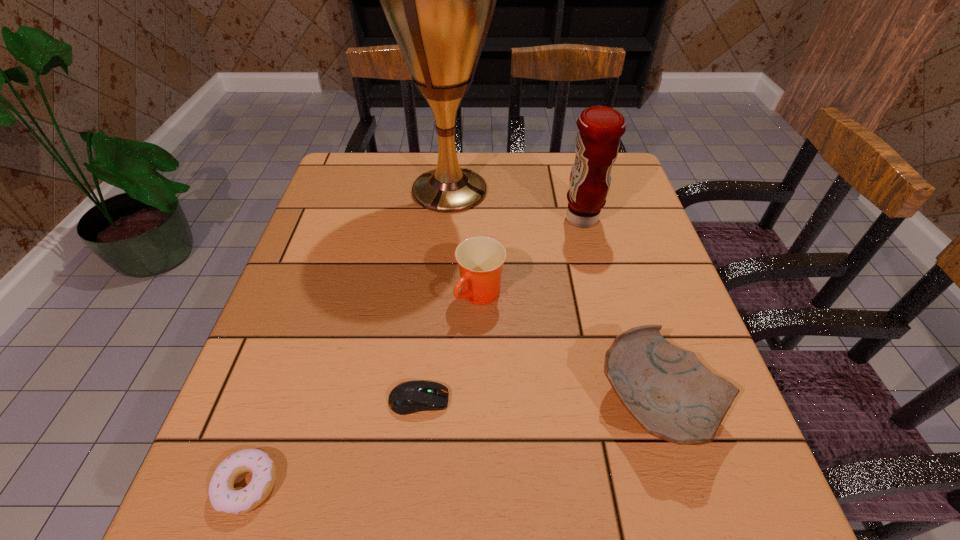
This screenshot has height=540, width=960. I want to click on free space between the doughnut and the cup, so click(364, 390).

Identify the location of free space that is in between the computer equipment and the pottery. (539, 402).

Identify the location of vacant space that's between the tallest object and the condiment. This screenshot has height=540, width=960. (516, 205).

Locate an element on the screen. Image resolution: width=960 pixels, height=540 pixels. free space that is in between the pottery and the second tallest object is located at coordinates (620, 311).

Locate an element on the screen. The image size is (960, 540). vacant area between the pottery and the second tallest object is located at coordinates (620, 311).

You are a GUI agent. You are given a task and a screenshot of the screen. Output one action in this format:
    pyautogui.click(x=<x>, y=<y>)
    Task: Click on the unoccupied position between the trophy cup and the fourth tallest object
    
    Given the screenshot: What is the action you would take?
    pyautogui.click(x=554, y=297)

Locate an element on the screen. This screenshot has height=540, width=960. the closest object to the fourth shortest object is located at coordinates (408, 397).

Where is `object that can be found as the closest to the tallest object`? object that can be found as the closest to the tallest object is located at coordinates (597, 144).

I want to click on free space that satisfies the following two spatial constraints: 1. on the front side of the pottery; 2. on the left side of the tallest object, so click(432, 403).

Where is `vacant area in the image that satisfies the following two spatial constraints: 1. on the back side of the leftmost object; 2. on the left side of the tallest object`? vacant area in the image that satisfies the following two spatial constraints: 1. on the back side of the leftmost object; 2. on the left side of the tallest object is located at coordinates (350, 191).